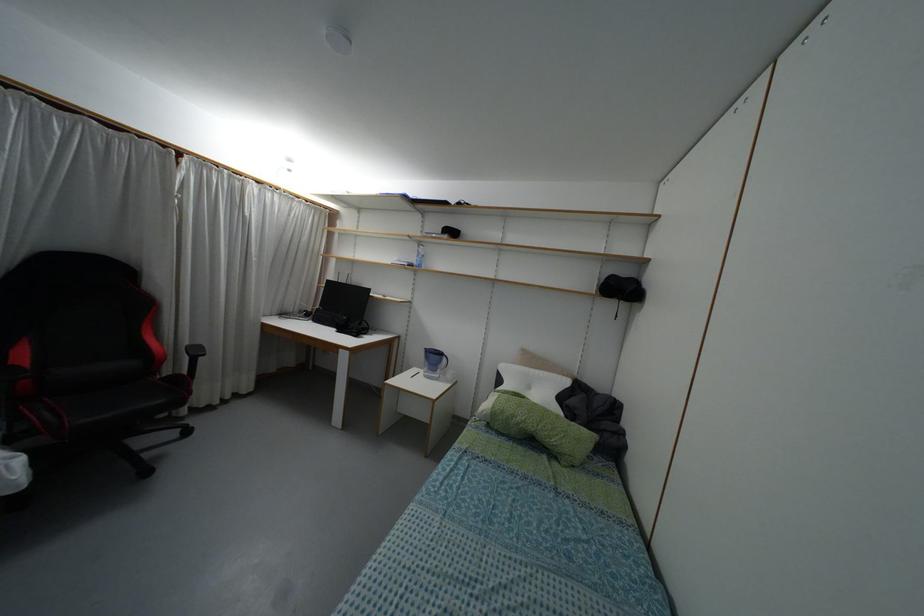
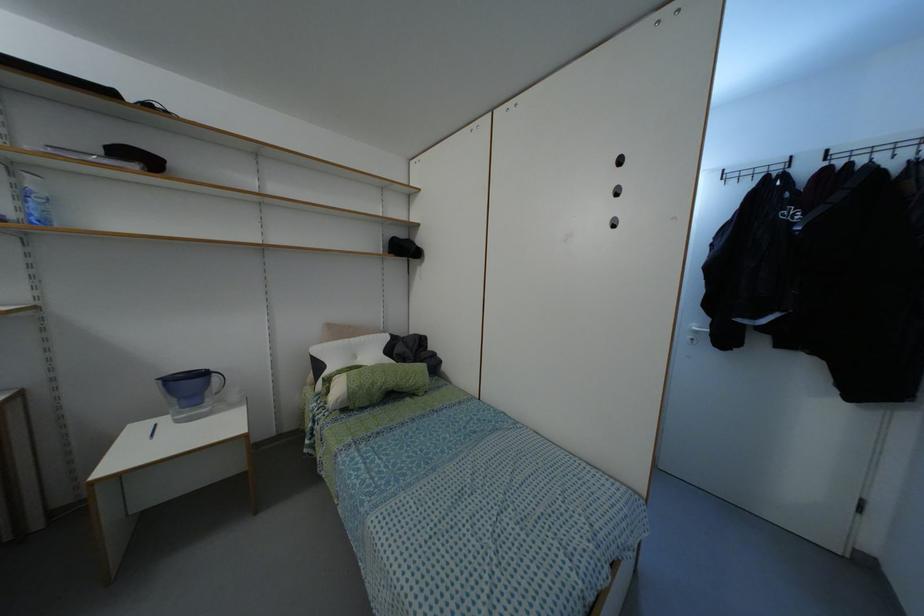
Question: The camera is either moving clockwise (left) or counter-clockwise (right) around the object. The first image is from the beginning of the video and the second image is from the end. Is the camera moving left or right when shooting the video?

Choices:
 (A) Left
 (B) Right

Answer: (A)